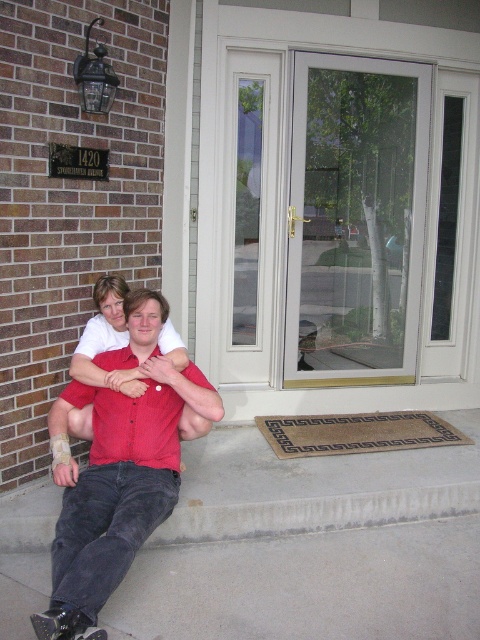
Question: Can you confirm if matte red shirt at center is positioned below black rubber skateboard at lower left?

Choices:
 (A) yes
 (B) no

Answer: (B)

Question: Does braided coir mat at lower center appear over black rubber skateboard at lower left?

Choices:
 (A) yes
 (B) no

Answer: (A)

Question: Which of these objects is positioned closest to the black rubber skateboard at lower left?

Choices:
 (A) red cotton shirt at center
 (B) matte red shirt at center

Answer: (A)

Question: Which point appears closest to the camera in this image?

Choices:
 (A) (74, 624)
 (B) (93, 618)
 (C) (417, 436)
 (D) (152, 408)

Answer: (A)

Question: Observing the image, what is the correct spatial positioning of red cotton shirt at center in reference to matte red shirt at center?

Choices:
 (A) left
 (B) right

Answer: (A)

Question: Which of the following is the closest to the observer?

Choices:
 (A) red cotton shirt at center
 (B) black rubber skateboard at lower left
 (C) braided coir mat at lower center

Answer: (B)